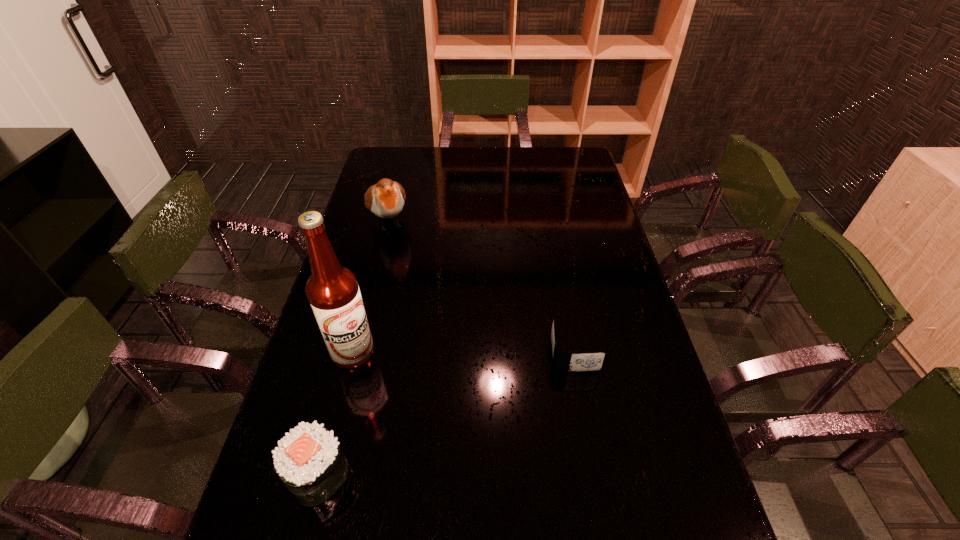
Locate an element on the screen. The height and width of the screenshot is (540, 960). free space that satisfies the following two spatial constraints: 1. on the front side of the second tallest object; 2. on the outer surface of the wallet is located at coordinates (356, 354).

You are a GUI agent. You are given a task and a screenshot of the screen. Output one action in this format:
    pyautogui.click(x=<x>, y=<y>)
    Task: Click on the vacant space that satisfies the following two spatial constraints: 1. on the back side of the nearest object; 2. on the outer surface of the rightmost object
    
    Given the screenshot: What is the action you would take?
    pyautogui.click(x=349, y=354)